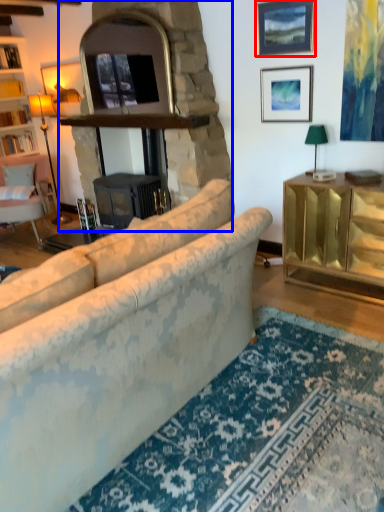
Question: Which of the following is the farthest to the observer, picture frame (highlighted by a red box) or fireplace (highlighted by a blue box)?

Choices:
 (A) picture frame
 (B) fireplace

Answer: (A)